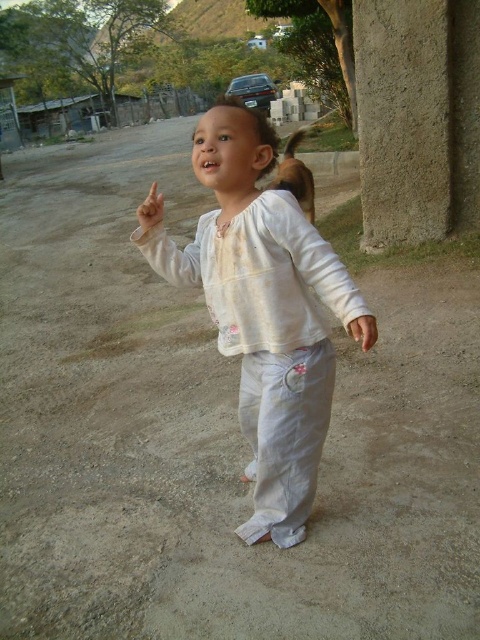
Describe the element at coordinates (264, 310) in the screenshot. I see `white cotton baby at center` at that location.

Identify the location of white cotton baby at center. (264, 310).